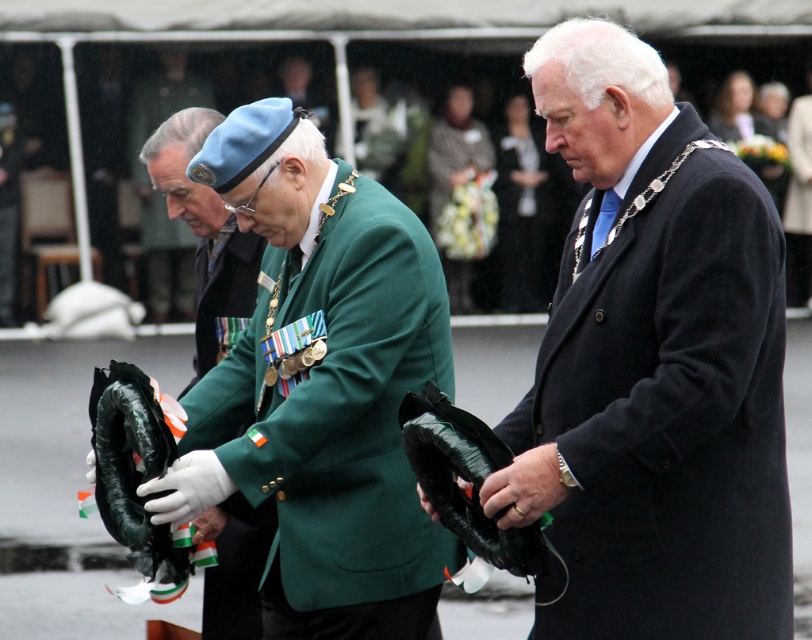
Is point (663, 196) closer to viewer compared to point (173, 134)?

Yes, it is.

Looking at this image, is matte black coat at center further to camera compared to green fabric beret at center?

No, matte black coat at center is closer to the viewer.

Measure the distance between point [620,385] and camera.

A distance of 11.59 meters exists between point [620,385] and camera.

The image size is (812, 640). Find the location of `matte black coat at center`. matte black coat at center is located at coordinates (653, 364).

Which is below, matte black coat at center or green matte jacket at center?

green matte jacket at center

Does point (624, 177) come farther from viewer compared to point (247, 397)?

No, it is not.

Find the location of a particular element. The width and height of the screenshot is (812, 640). matte black coat at center is located at coordinates (653, 364).

Between green matte jacket at center and green fabric beret at center, which one appears on the right side from the viewer's perspective?

From the viewer's perspective, green matte jacket at center appears more on the right side.

Find the location of `green matte jacket at center`. green matte jacket at center is located at coordinates (322, 385).

This screenshot has height=640, width=812. Find the location of `green matte jacket at center`. green matte jacket at center is located at coordinates (322, 385).